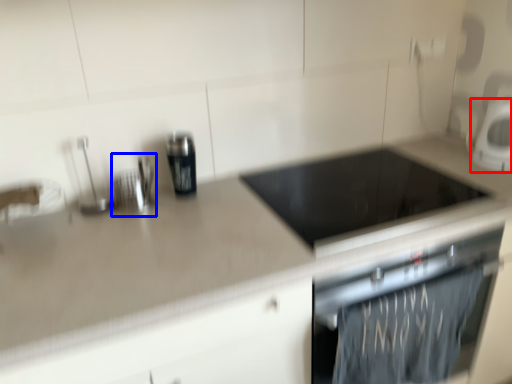
Question: Which object is further to the camera taking this photo, kitchen appliance (highlighted by a red box) or appliance (highlighted by a blue box)?

Choices:
 (A) kitchen appliance
 (B) appliance

Answer: (A)